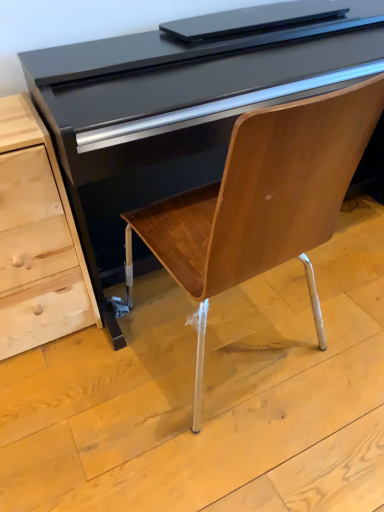
Where is `vacant region to the right of glossy black piano at center`? vacant region to the right of glossy black piano at center is located at coordinates (337, 314).